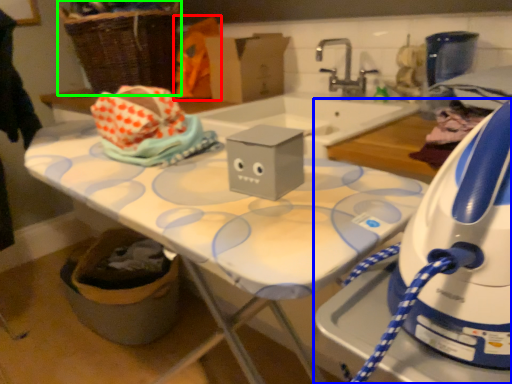
Question: Considering the real-world distances, which object is closest to fabric (highlighted by a red box)? home appliance (highlighted by a blue box) or basket (highlighted by a green box).

Choices:
 (A) home appliance
 (B) basket

Answer: (B)